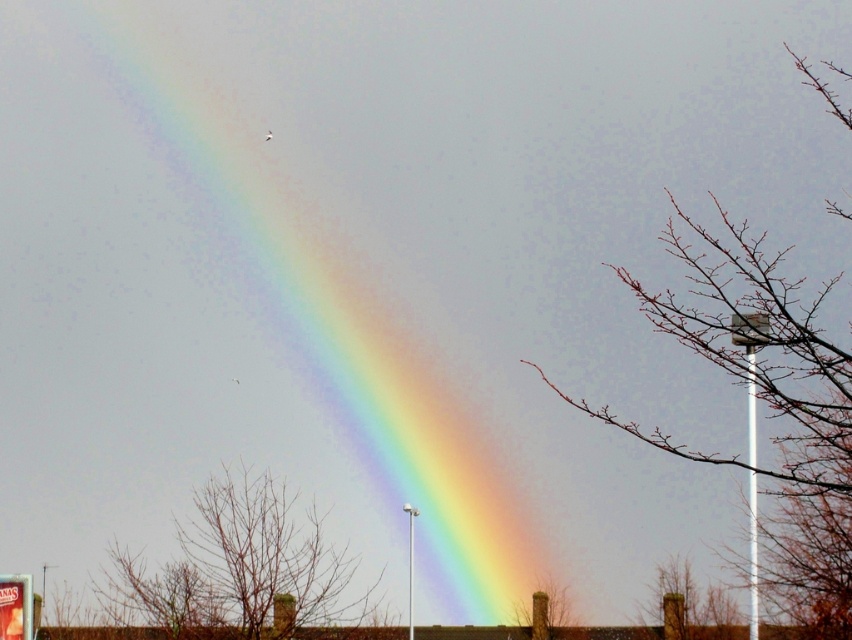
Question: Is brown textured tree at lower right above bare branches at lower center?

Choices:
 (A) yes
 (B) no

Answer: (A)

Question: From the image, what is the correct spatial relationship of bare branches at right in relation to brown textured tree at lower right?

Choices:
 (A) left
 (B) right

Answer: (A)

Question: Which of these objects is positioned closest to the bare branches at center?

Choices:
 (A) bare branches at lower center
 (B) bare branches at right

Answer: (B)

Question: Which of the following is the farthest from the observer?

Choices:
 (A) bare branches at lower center
 (B) rainbow at upper center

Answer: (B)

Question: Is rainbow at upper center to the left of bare branches at center from the viewer's perspective?

Choices:
 (A) no
 (B) yes

Answer: (A)

Question: Which object is closer to the camera taking this photo?

Choices:
 (A) bare branches at lower center
 (B) rainbow at upper center

Answer: (A)